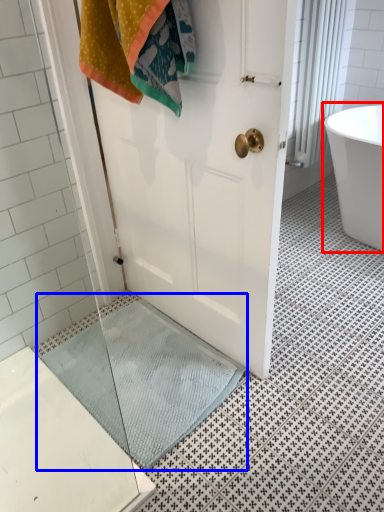
Question: Which object appears closest to the camera in this image, bathtub (highlighted by a red box) or bath mat (highlighted by a blue box)?

Choices:
 (A) bathtub
 (B) bath mat

Answer: (B)